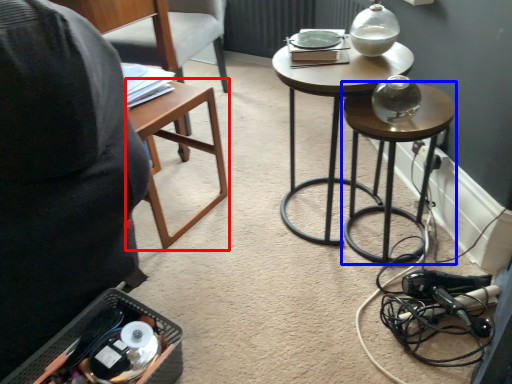
Question: Which of the following is the closest to the observer, table (highlighted by a red box) or stool (highlighted by a blue box)?

Choices:
 (A) table
 (B) stool

Answer: (B)